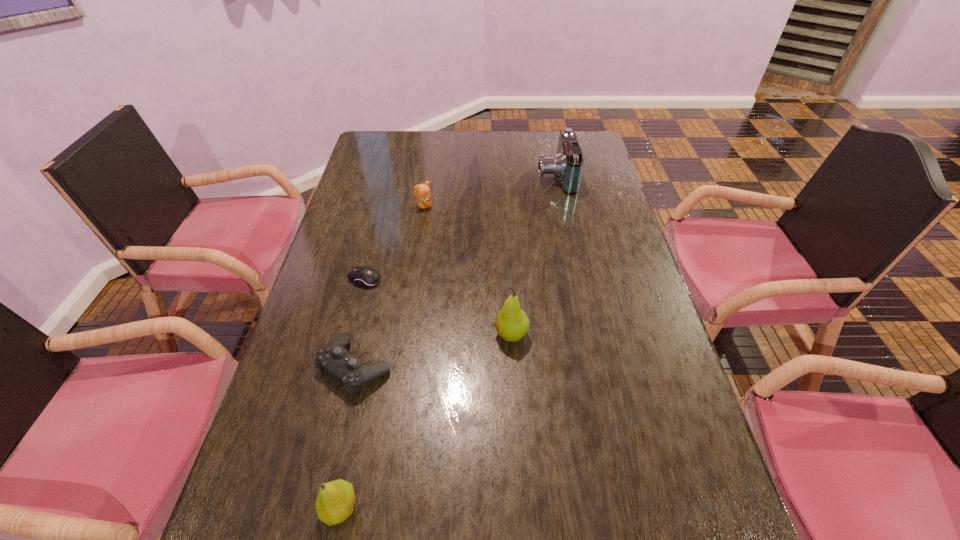
Find the location of a particular element. the nearer pear is located at coordinates (335, 502).

Find the location of a particular element. Image resolution: width=960 pixels, height=540 pixels. the shorter pear is located at coordinates (335, 502).

You are a GUI agent. You are given a task and a screenshot of the screen. Output one action in this format:
    pyautogui.click(x=<x>, y=<y>)
    Task: Click on the farther pear
    
    Given the screenshot: What is the action you would take?
    pyautogui.click(x=512, y=323)

Identify the location of the fifth object from left to right. (512, 323).

Find the location of a particular element. the rightmost object is located at coordinates (567, 165).

At what (x,y) coordinates should I click in order to perform the action: click on the farthest object. Please return your answer as a coordinate pair (x, y). This screenshot has width=960, height=540. Looking at the image, I should click on (567, 165).

Identify the location of teddy bear. The width and height of the screenshot is (960, 540). (422, 192).

This screenshot has height=540, width=960. I want to click on the fifth nearest object, so click(422, 192).

Where is `the third farthest object`? the third farthest object is located at coordinates (364, 276).

Where is `the shortest object`? This screenshot has height=540, width=960. the shortest object is located at coordinates (364, 276).